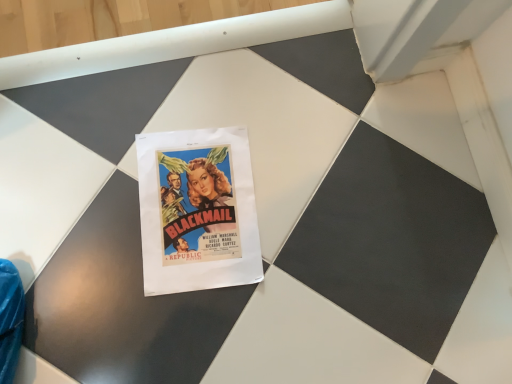
The height and width of the screenshot is (384, 512). Describe the element at coordinates (197, 210) in the screenshot. I see `white paper poster at center` at that location.

Locate an element on the screen. white paper poster at center is located at coordinates (197, 210).

Identify the location of white paper poster at center. (197, 210).